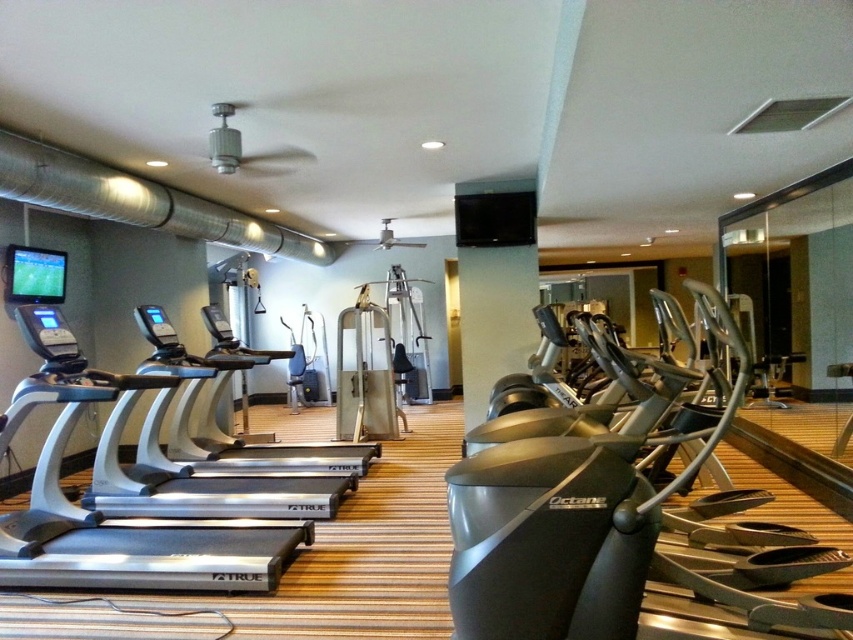
You are a gym member who wants to use a treadmill. You are standing in front of the silver metallic treadmill at left and the silver metallic treadmill at center. Which treadmill is closer to the floor?

The silver metallic treadmill at left is positioned under the silver metallic treadmill at center, so the silver metallic treadmill at left is closer to the floor.

You are standing at the entrance of the gym and see a point marked at coordinates (622, 525). What object is located at that point?

The point at coordinates (622, 525) corresponds to the black rubberized elliptical at center.

You are standing in the gym and want to use the treadmill that is farther away from you. Which one should you choose between the silver metallic treadmill at left and the silver metallic treadmill at center?

You should choose the silver metallic treadmill at center because it is farther away from you compared to the silver metallic treadmill at left, which is closer.